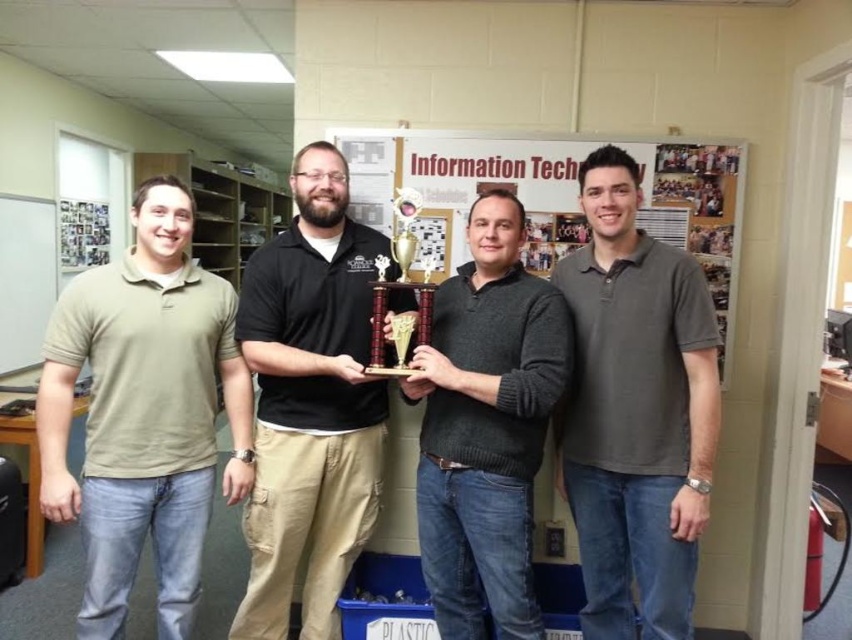
Based on the photo, you are a photographer taking a picture of the dark gray polo shirt at right and the dark gray sweater at center. Which one is positioned higher in the frame?

The dark gray polo shirt at right is positioned higher in the frame than the dark gray sweater at center.

What are the coordinates of the olive green polo shirt at left in the image?

The olive green polo shirt at left is located at coordinates point (144,413).